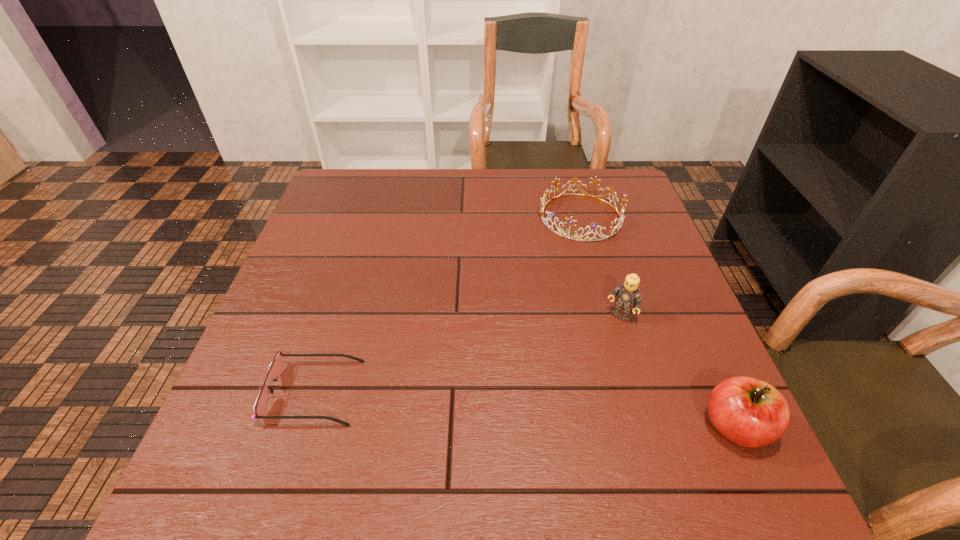
Identify the location of vacant position located 0.320m in front of the Lego. The image size is (960, 540). (525, 434).

At what (x,y) coordinates should I click in order to perform the action: click on free spot located on the front-facing side of the tiara. Please return your answer as a coordinate pair (x, y). The width and height of the screenshot is (960, 540). Looking at the image, I should click on (540, 290).

Locate an element on the screen. vacant space situated 0.080m on the front-facing side of the tiara is located at coordinates (558, 259).

What are the coordinates of `free space located on the front-facing side of the tiara` in the screenshot? It's located at (529, 310).

Where is `object that is at the far edge`? This screenshot has width=960, height=540. object that is at the far edge is located at coordinates (570, 221).

I want to click on sunglasses situated at the near edge, so click(x=275, y=368).

This screenshot has height=540, width=960. Identify the location of apple that is at the near edge. (749, 412).

At what (x,y) coordinates should I click in order to perform the action: click on object located in the left edge section of the desktop. Please return your answer as a coordinate pair (x, y). Looking at the image, I should click on (275, 368).

What are the coordinates of `apple positioned at the right edge` in the screenshot? It's located at (749, 412).

The image size is (960, 540). What are the coordinates of `Lego that is at the right edge` in the screenshot? It's located at (628, 298).